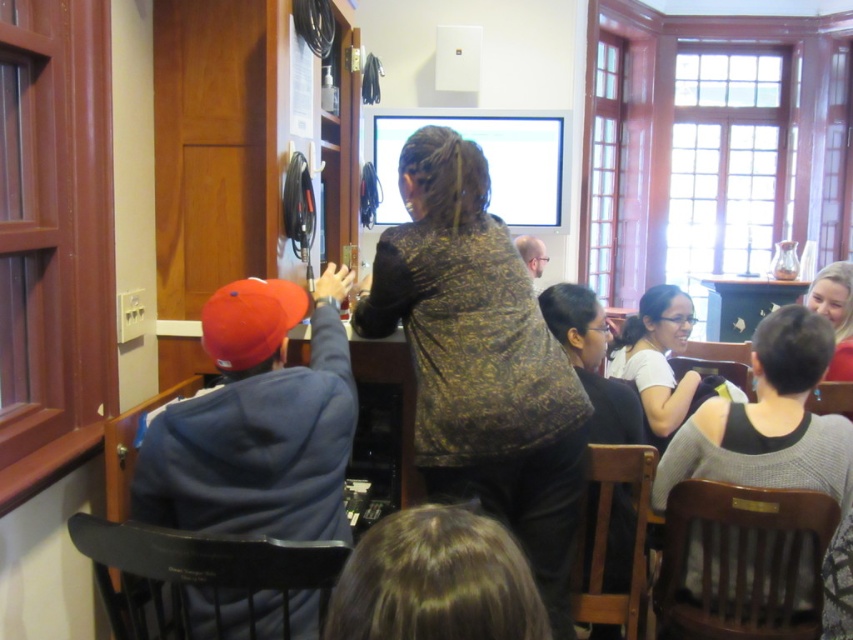
You are attending a meeting and notice two people at the front of the room. One is wearing a gold textured jacket at center and the other a white matte shirt at center. From your perspective, which person is closer to the front of the room?

The gold textured jacket at center is closer to the front of the room because it is in front of the white matte shirt at center.

You are a person who is 1.7 meters tall and standing at the back of the room. You want to hand a document to both the gold textured jacket at center and the white matte shirt at center. Can you reach both of them without moving closer?

The distance between the gold textured jacket at center and the white matte shirt at center is 1.07 meters. Since you are 1.7 meters tall, you can likely reach both individuals as the distance between them is shorter than your height, allowing you to extend your arm to reach both.

You are attending a meeting and need to locate the presenter. The presenter is wearing a gold textured jacket at center and has matte black hair at upper right. Which object is closer to the left side of the room?

The gold textured jacket at center is closer to the left side of the room since it is positioned to the left of the matte black hair at upper right.